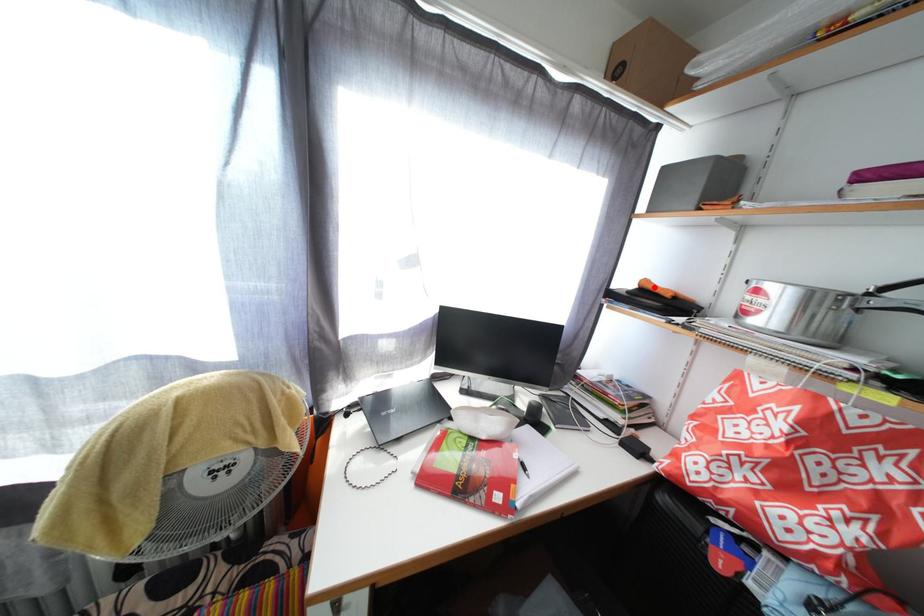
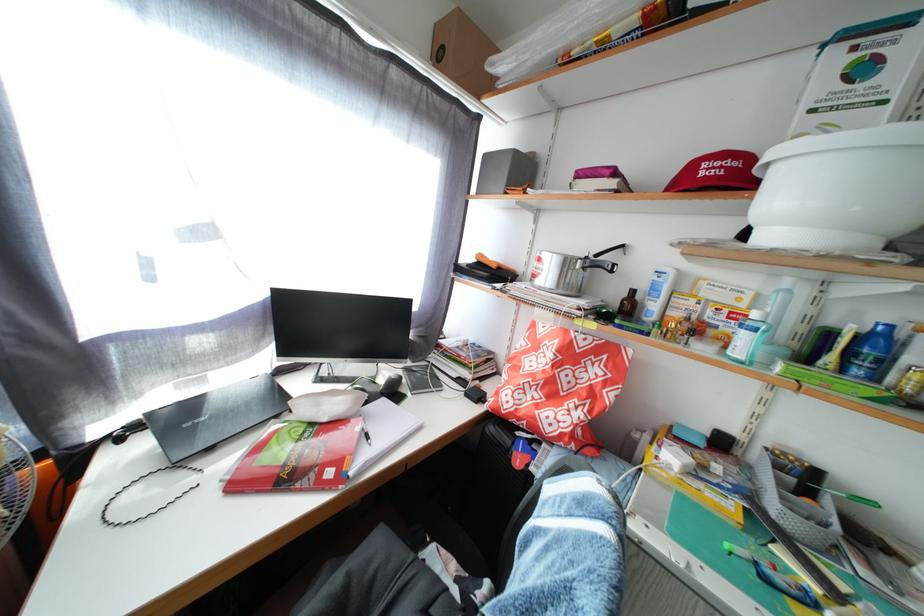
The point at the highlighted location is marked in the first image. Where is the corresponding point in the second image?

(489, 262)